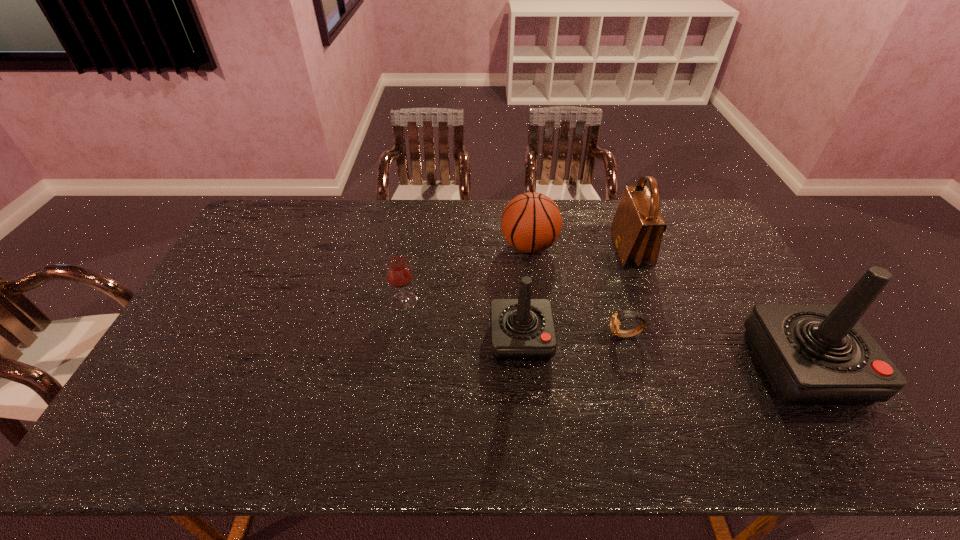
Please point a spot on the left to add another joystick. Please provide its 2D coordinates. Your answer should be formatted as a tuple, i.e. [(x, y)], where the tuple contains the x and y coordinates of a point satisfying the conditions above.

[(268, 313)]